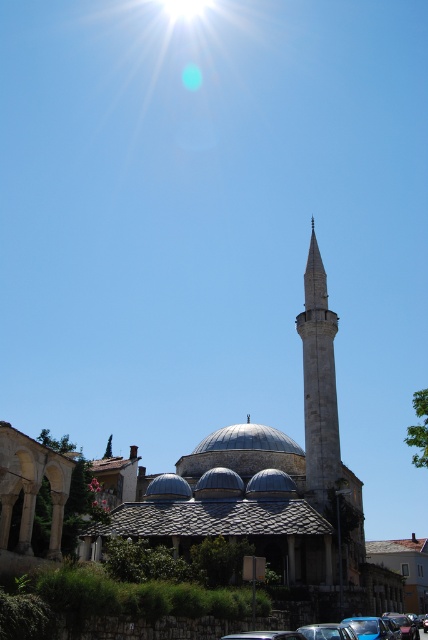
Between white stone minaret at center and metallic silver car at center, which one appears on the right side from the viewer's perspective?

From the viewer's perspective, white stone minaret at center appears more on the right side.

Is white stone minaret at center smaller than metallic silver car at center?

No.

Does point (323, 392) come in front of point (338, 627)?

No, it is behind (338, 627).

What are the coordinates of `white stone minaret at center` in the screenshot? It's located at (318, 380).

Is smooth gray dome at center positioned before metallic silver car at center?

No, it is not.

Is smooth gray dome at center taller than metallic silver car at center?

In fact, smooth gray dome at center may be shorter than metallic silver car at center.

The width and height of the screenshot is (428, 640). I want to click on smooth gray dome at center, so click(x=249, y=440).

Does metallic blue car at lower center have a greater width compared to blue metallic car at lower center?

Indeed, metallic blue car at lower center has a greater width compared to blue metallic car at lower center.

From the picture: Can you confirm if metallic blue car at lower center is smaller than blue metallic car at lower center?

No, metallic blue car at lower center is not smaller than blue metallic car at lower center.

Is point (412, 636) positioned behind point (359, 636)?

Yes, point (412, 636) is farther from viewer.

You are a GUI agent. You are given a task and a screenshot of the screen. Output one action in this format:
    pyautogui.click(x=<x>, y=<y>)
    Task: Click on the metallic blue car at lower center
    The height and width of the screenshot is (640, 428).
    Given the screenshot: What is the action you would take?
    pyautogui.click(x=386, y=627)